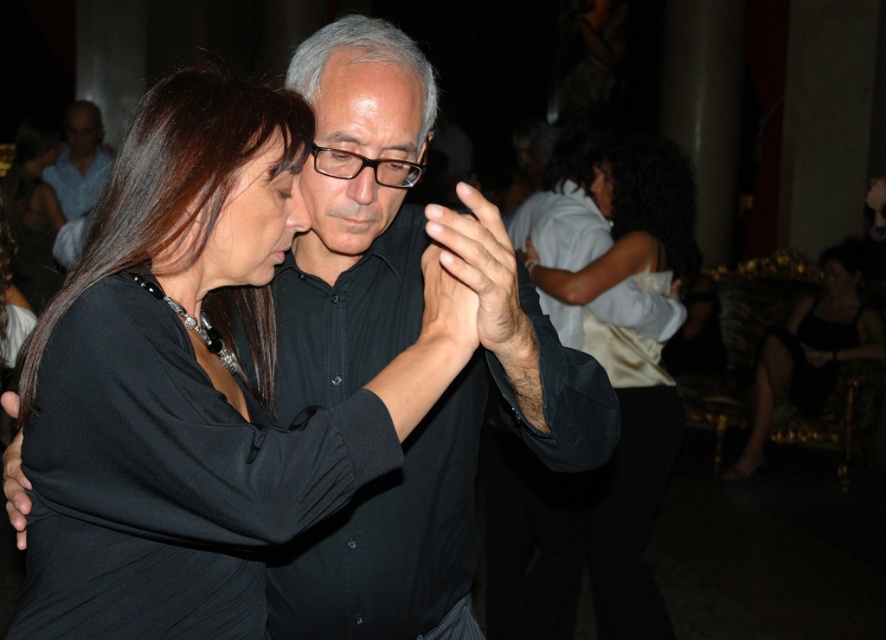
You are a photographer at the event and need to adjust your camera settings. The matte black shirt at upper left and the black plastic glasses at center are both in your frame. Which object should you focus on if you want to ensure the wider one is in sharp focus?

The matte black shirt at upper left is wider than the black plastic glasses at center, so focusing on the matte black shirt at upper left will ensure the wider object is in sharp focus.

You are a photographer at the event and want to capture a photo of both the black matte shirt at center and the matte black shirt at upper left. Which one is positioned to the right side of the other?

The black matte shirt at center is to the right of matte black shirt at upper left.

You are standing in the middle of the dance floor and see two points marked in the image. One is at coordinates point (x=395, y=48) and the other at point (x=92, y=141). Which point is closer to you?

Point (x=395, y=48) is closer to the viewer than point (x=92, y=141).